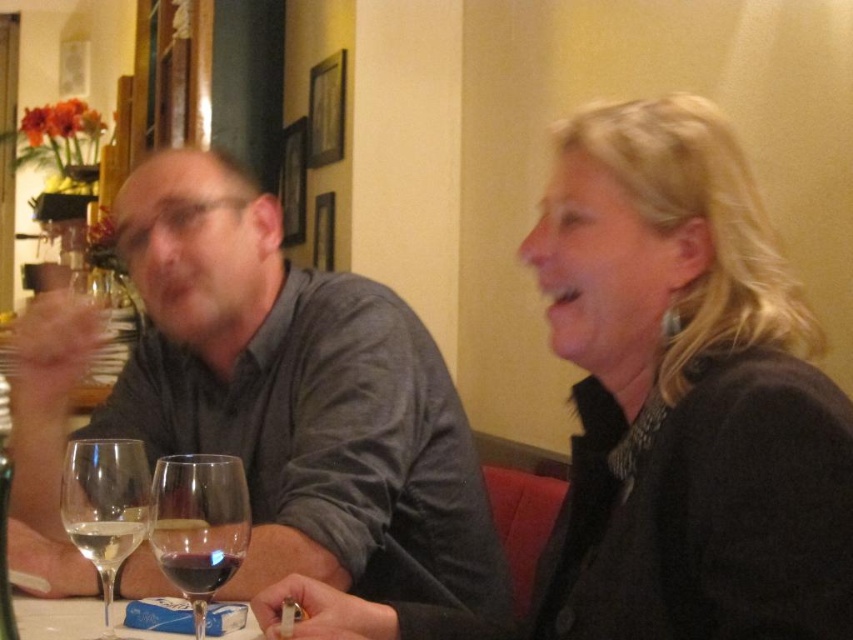
You are a waiter in a restaurant and need to deliver a dessert menu to the customer wearing the gray matte shirt at left. The clear glass wine glass at lower left is in your path. Can you walk around the glass to reach the customer without moving the glass?

The gray matte shirt at left is to the right of the clear glass wine glass at lower left, so you can walk around the glass to the right side to reach the customer without moving the glass.

You are a photographer taking a photo of the gray matte shirt at left and the clear glass wine at lower left. Which object should you focus on first if you want to ensure both are in focus, considering their sizes?

The gray matte shirt at left is wider than the clear glass wine at lower left, so focusing on the gray matte shirt at left first would help ensure both are in focus due to its larger size.

You are a waiter in a restaurant. You need to place a new order of a salad at point (299,396). However, there is already an object at that location. What object is currently at that point?

The gray matte shirt at left is currently at point (299,396).